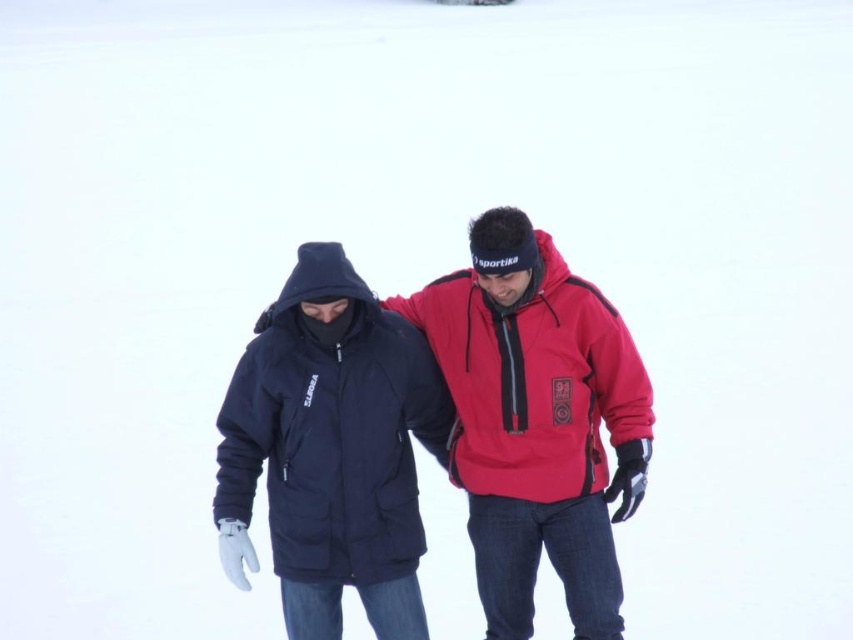
You are standing in the snowy environment and want to determine which of the two points, point (482, 493) or point (631, 371), is closer to you. Based on their positions, which point is nearer?

Point (482, 493) is further to the viewer than point (631, 371), so point (631, 371) is closer to you.